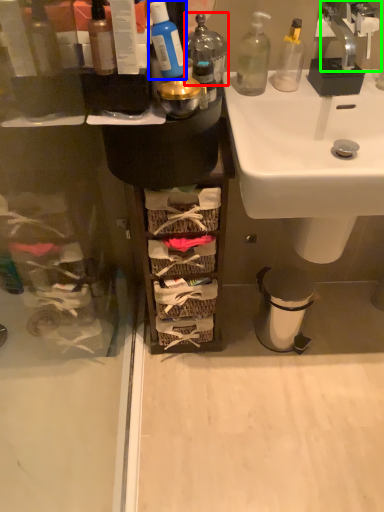
Question: Which object is the closest to the toiletry (highlighted by a red box)? Choose among these: toiletry (highlighted by a blue box) or tap (highlighted by a green box).

Choices:
 (A) toiletry
 (B) tap

Answer: (A)